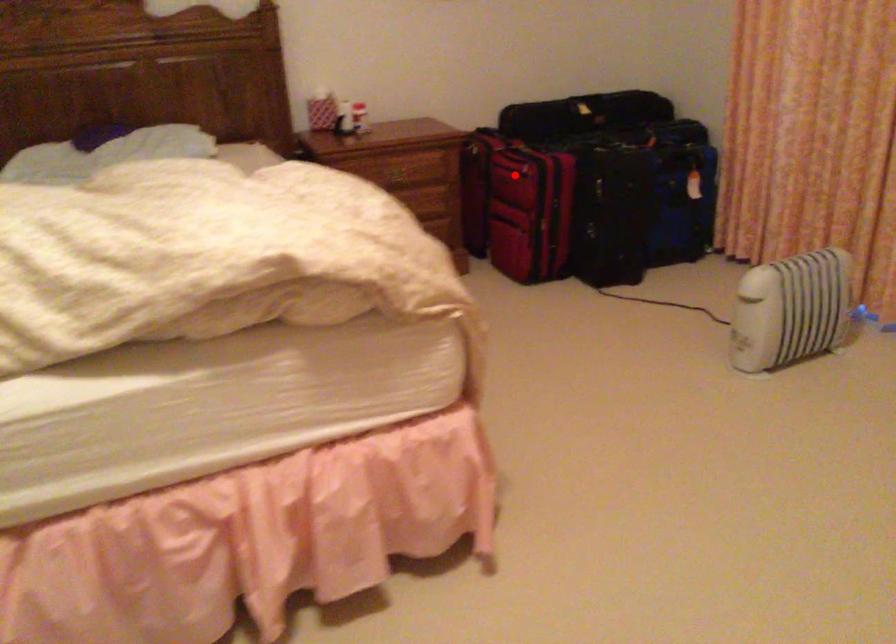
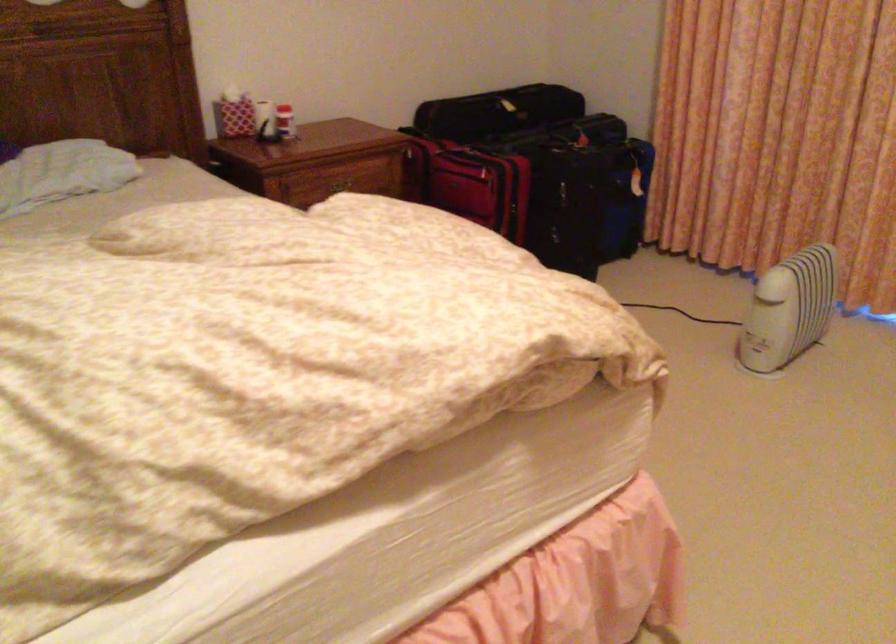
In the second image, find the point that corresponds to the highlighted location in the first image.

(469, 183)